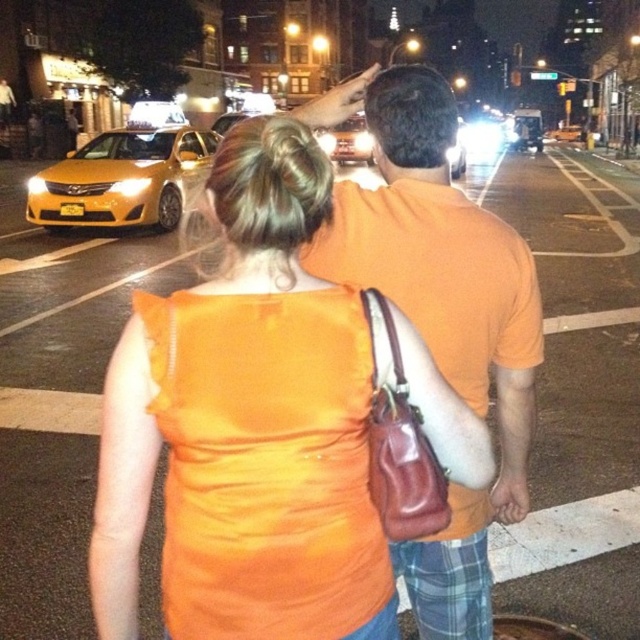
You are a pedestrian standing at the crosswalk and see the orange matte shirt at center and the yellow matte taxi at left. Which object is closer to the left side of the crosswalk?

The yellow matte taxi at left is closer to the left side of the crosswalk because the orange matte shirt at center is positioned on the right side of it.

You are a photographer standing at the crosswalk in the image. You want to take a photo that includes both the orange matte shirt at center and the yellow matte taxi at left. Which object should you focus on first to ensure both are in frame?

The orange matte shirt at center is much taller than the yellow matte taxi at left, so you should focus on the orange matte shirt at center first to ensure both are in frame.

Looking at this image, you are a photographer standing at the point marked by the coordinates point (276,404). You want to take a picture of the orange satin dress at center. Which direction should you move to get a better shot?

Answer: The point (276,404) is already at the orange satin dress at center, so you are already positioned directly at the dress. No movement is needed for the shot.